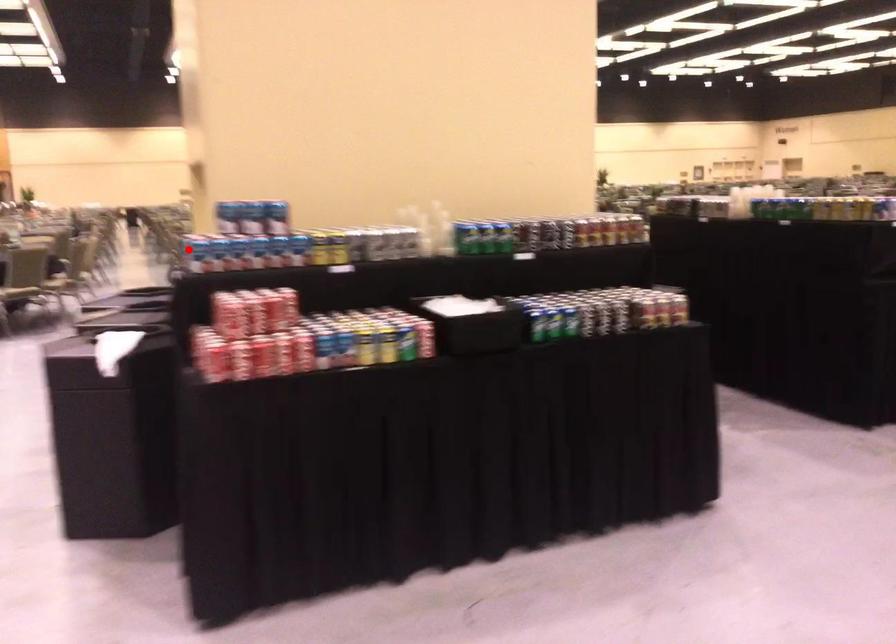
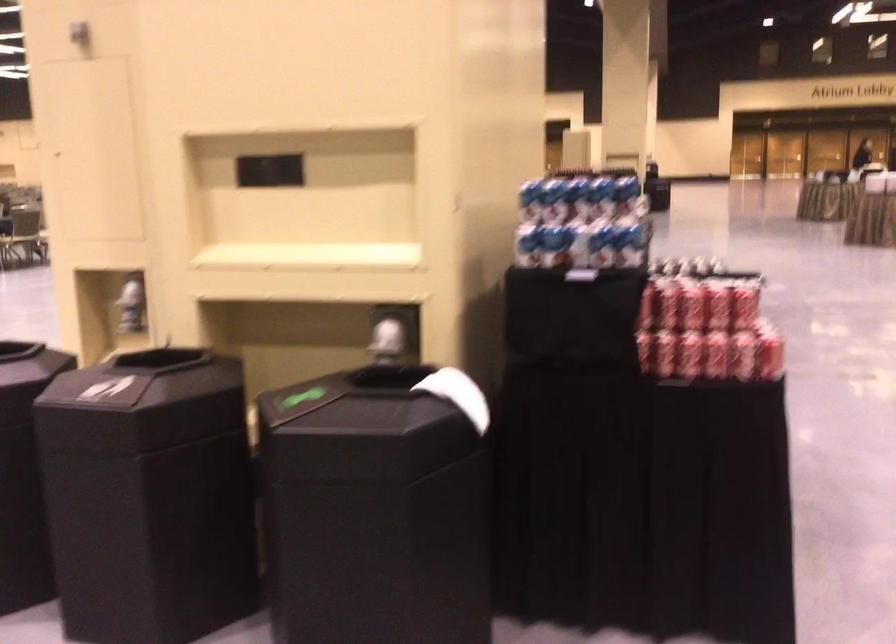
Find the pixel in the second image that matches the highlighted location in the first image.

(553, 245)